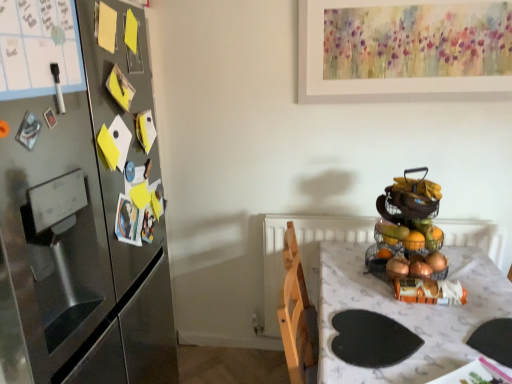
At what (x,y) coordinates should I click in order to perform the action: click on free spot to the left of wire mesh basket at right, the 2th basket when ordered from top to bottom. Please return your answer as a coordinate pair (x, y). This screenshot has width=512, height=384. Looking at the image, I should click on (350, 261).